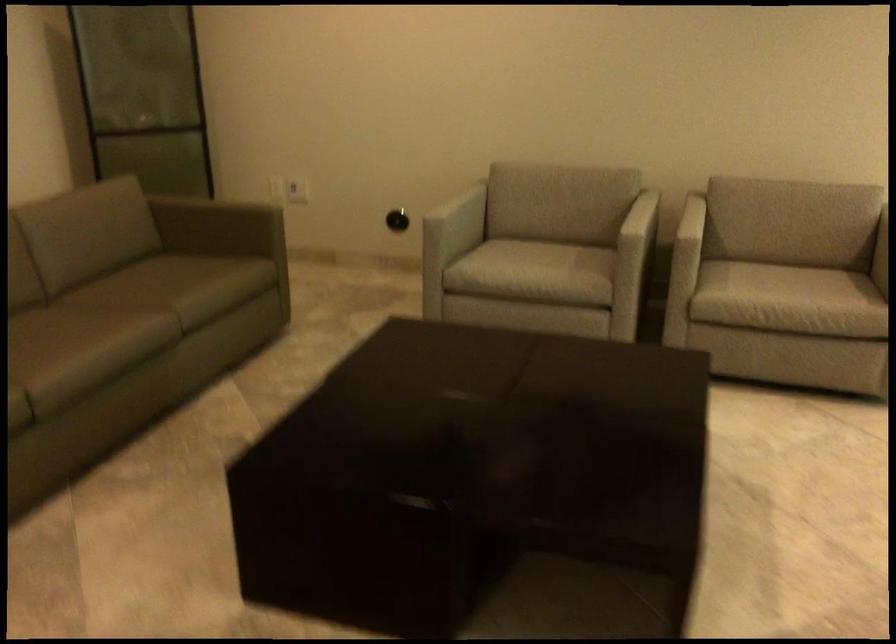
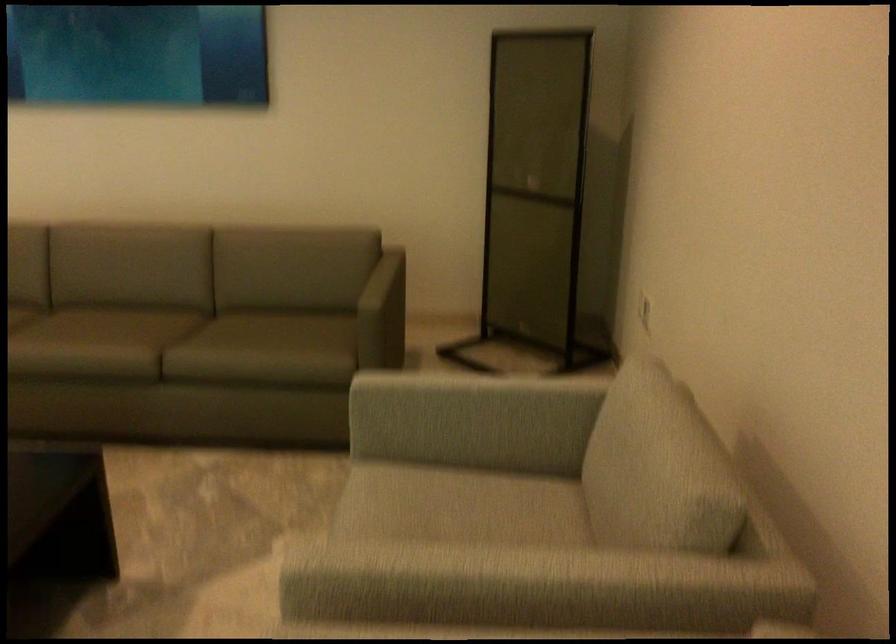
Locate, in the second image, the point that corresponds to point (572, 169) in the first image.

(653, 451)